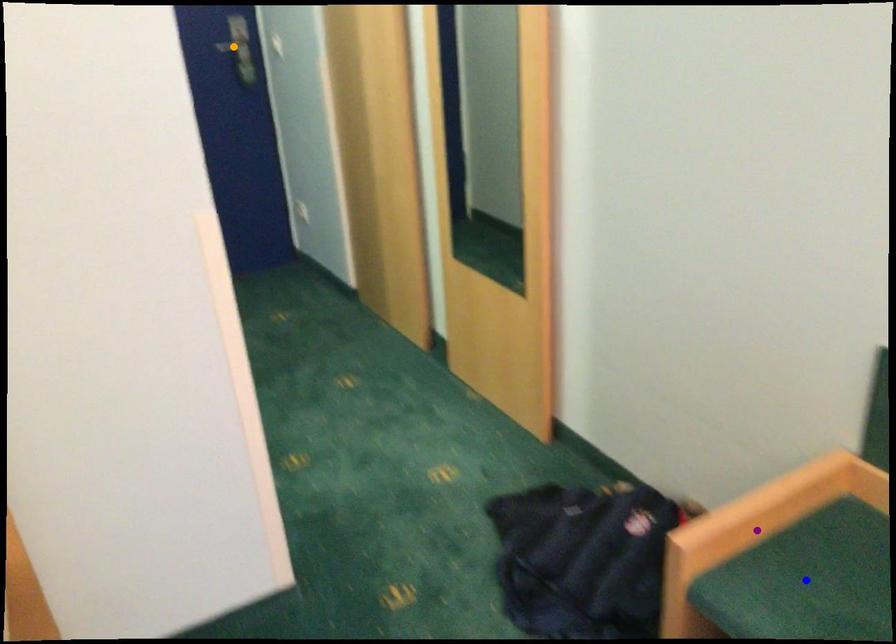
Order these from farthest to nearest:
1. blue point
2. orange point
3. purple point

orange point < purple point < blue point